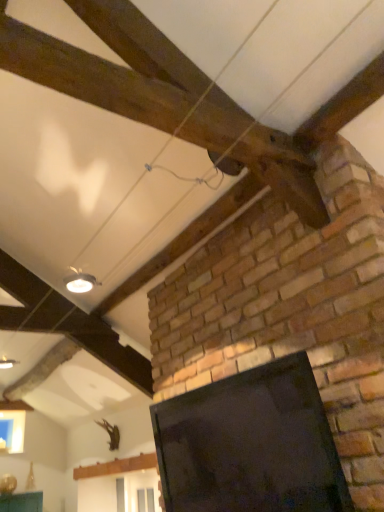
Question: Does black glossy screen at center come behind white glossy light fixture at upper left?

Choices:
 (A) yes
 (B) no

Answer: (B)

Question: Can you confirm if black glossy screen at center is shorter than white glossy light fixture at upper left?

Choices:
 (A) yes
 (B) no

Answer: (B)

Question: Does black glossy screen at center contain white glossy light fixture at upper left?

Choices:
 (A) yes
 (B) no

Answer: (B)

Question: Is black glossy screen at center taller than white glossy light fixture at upper left?

Choices:
 (A) no
 (B) yes

Answer: (B)

Question: Is black glossy screen at center oriented away from white glossy light fixture at upper left?

Choices:
 (A) yes
 (B) no

Answer: (B)

Question: From a real-world perspective, is black glossy screen at center physically above white glossy light fixture at upper left?

Choices:
 (A) no
 (B) yes

Answer: (A)

Question: From a real-world perspective, is white glossy light fixture at upper left on black glossy screen at center?

Choices:
 (A) yes
 (B) no

Answer: (A)

Question: Is white glossy light fixture at upper left further to camera compared to black glossy screen at center?

Choices:
 (A) no
 (B) yes

Answer: (B)

Question: Is white glossy light fixture at upper left closer to the viewer compared to black glossy screen at center?

Choices:
 (A) no
 (B) yes

Answer: (A)

Question: Is white glossy light fixture at upper left located outside black glossy screen at center?

Choices:
 (A) yes
 (B) no

Answer: (A)

Question: From the image's perspective, would you say white glossy light fixture at upper left is positioned over black glossy screen at center?

Choices:
 (A) yes
 (B) no

Answer: (A)

Question: Does white glossy light fixture at upper left have a lesser height compared to black glossy screen at center?

Choices:
 (A) no
 (B) yes

Answer: (B)

Question: Is black glossy screen at center inside the boundaries of white glossy light fixture at upper left, or outside?

Choices:
 (A) outside
 (B) inside

Answer: (A)